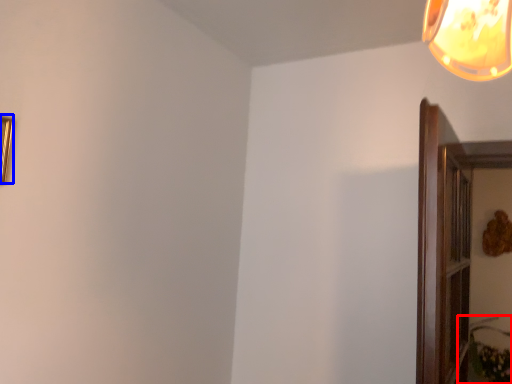
Question: Among these objects, which one is farthest to the camera, plant (highlighted by a red box) or picture frame (highlighted by a blue box)?

Choices:
 (A) plant
 (B) picture frame

Answer: (A)